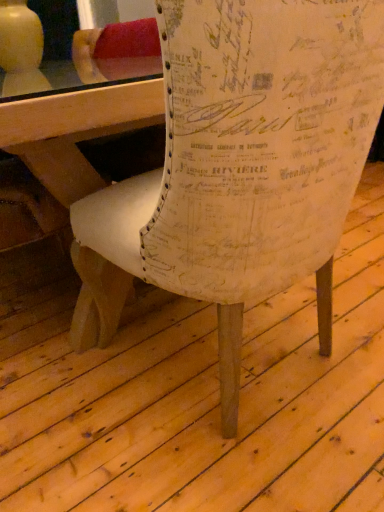
Image resolution: width=384 pixels, height=512 pixels. Describe the element at coordinates (240, 166) in the screenshot. I see `white fabric chair at center` at that location.

Identify the location of white fabric chair at center. (240, 166).

This screenshot has width=384, height=512. In order to click on white fabric chair at center in this screenshot , I will do `click(240, 166)`.